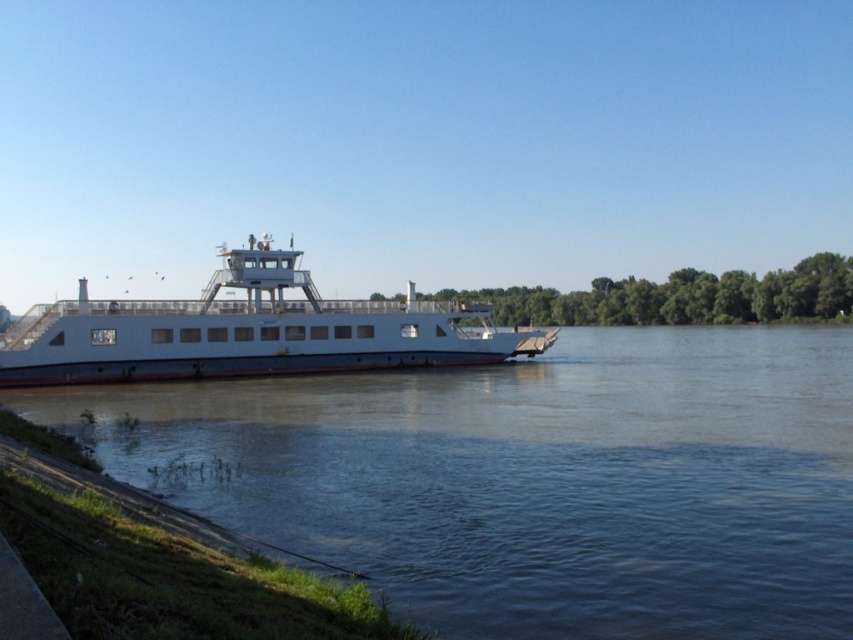
Which is more to the left, brown matte river at center or white matte ferry at center?

Positioned to the left is white matte ferry at center.

Measure the distance between point (689, 628) and camera.

A distance of 33.58 feet exists between point (689, 628) and camera.

You are a GUI agent. You are given a task and a screenshot of the screen. Output one action in this format:
    pyautogui.click(x=<x>, y=<y>)
    Task: Click on the brown matte river at center
    
    Given the screenshot: What is the action you would take?
    pyautogui.click(x=532, y=480)